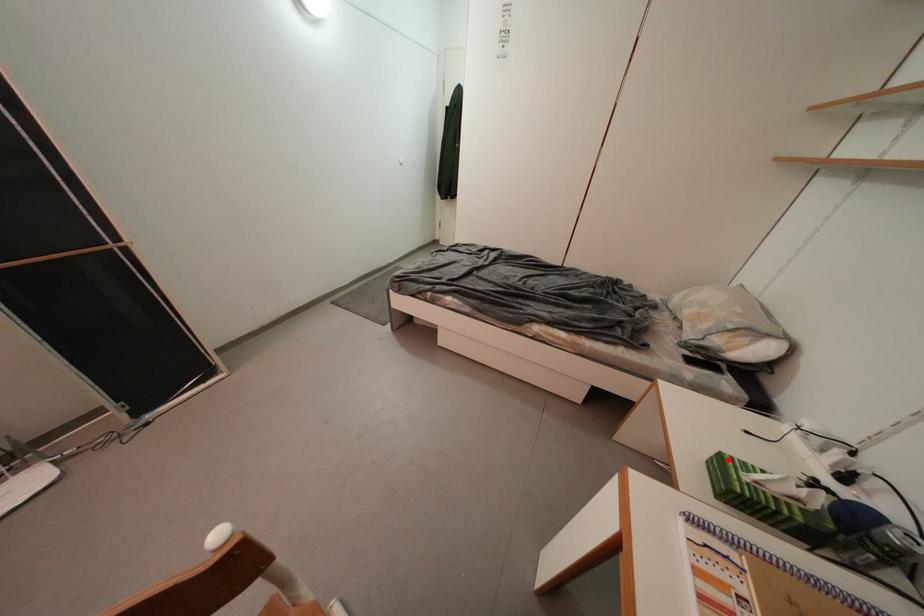
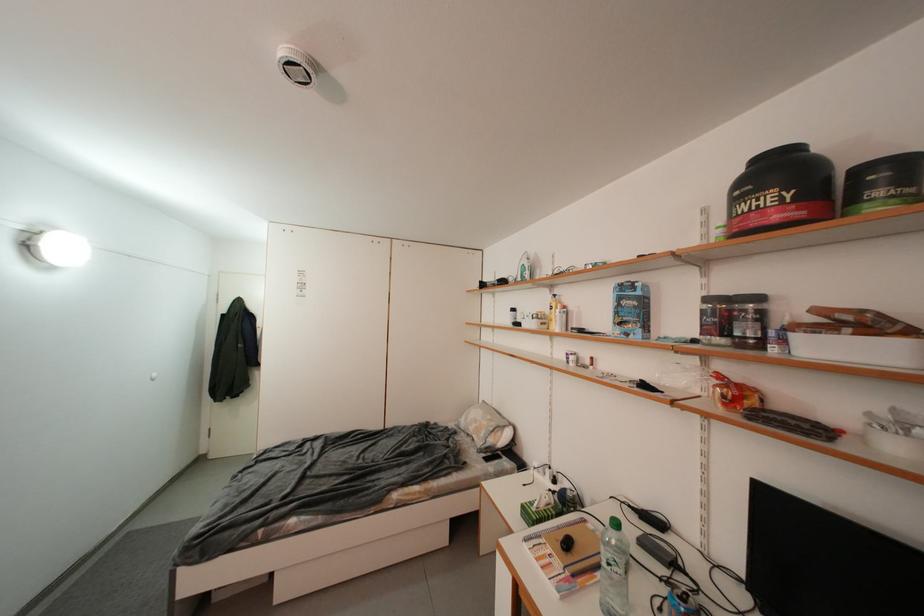
Where in the second image is the point corresponding to the highlighted location from the first image?

(530, 509)